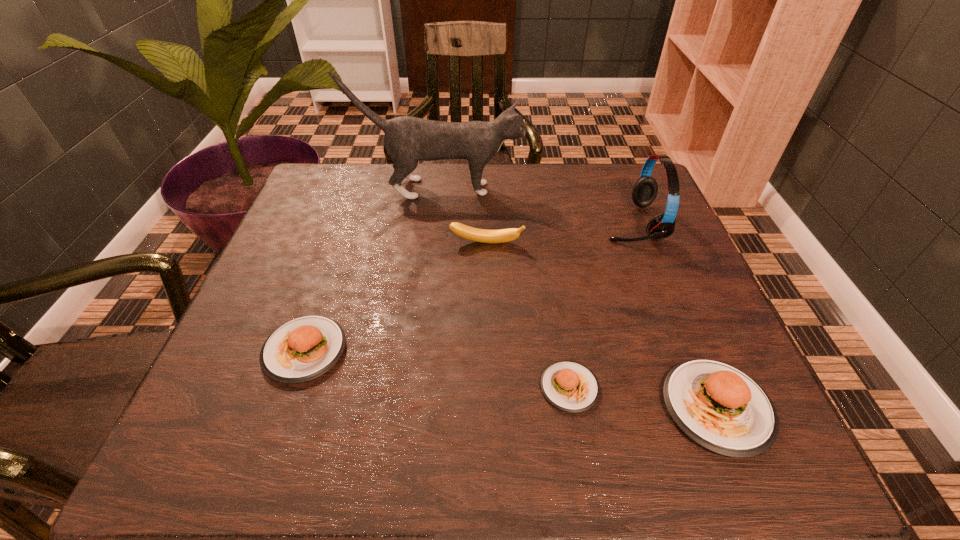
You are a GUI agent. You are given a task and a screenshot of the screen. Output one action in this format:
    pyautogui.click(x=<x>, y=<y>)
    Task: Click on the fifth tallest object
    Image resolution: width=960 pixels, height=540 pixels.
    Given the screenshot: What is the action you would take?
    pyautogui.click(x=302, y=349)

Locate an element on the screen. Image resolution: width=960 pixels, height=540 pixels. the second tallest food is located at coordinates (302, 349).

Find the location of a particular element. This screenshot has width=960, height=540. the shortest object is located at coordinates (570, 386).

I want to click on the shortest food, so click(x=570, y=386).

Identify the location of the rightmost food. This screenshot has height=540, width=960. (721, 408).

Find the location of a particular element. the tallest object is located at coordinates (407, 140).

Locate an element on the screen. The image size is (960, 540). headset is located at coordinates (644, 192).

What are the coordinates of `banana` in the screenshot? It's located at (474, 234).

This screenshot has width=960, height=540. Find the location of `vacant space located 0.110m on the back of the leftmost food`. vacant space located 0.110m on the back of the leftmost food is located at coordinates (329, 279).

This screenshot has width=960, height=540. Find the location of `vacant region located 0.070m on the left of the shortest food`. vacant region located 0.070m on the left of the shortest food is located at coordinates (499, 387).